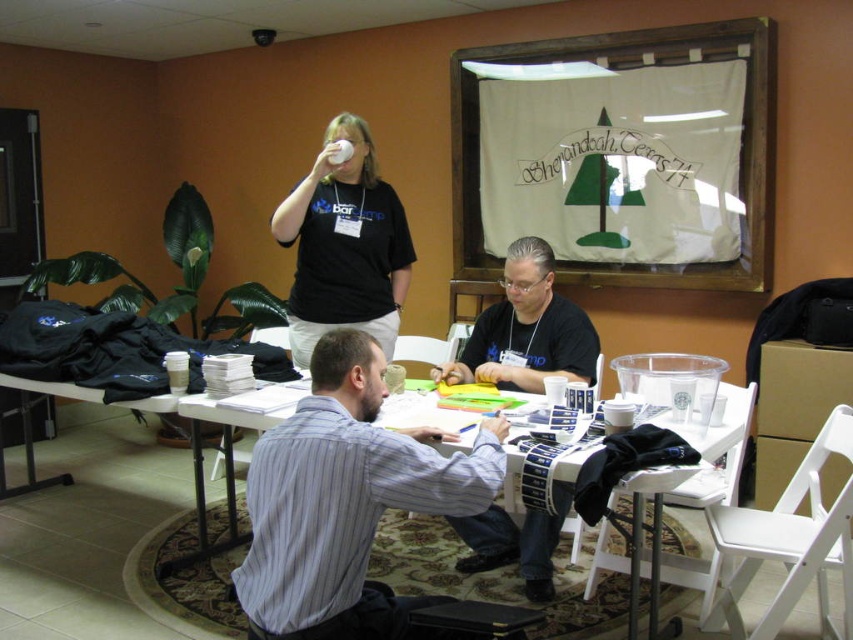
Who is more forward, (292, 483) or (383, 304)?

Point (292, 483) is in front.

Can you confirm if striped cotton shirt at center is taller than matte black shirt at upper center?

Incorrect, striped cotton shirt at center's height is not larger of matte black shirt at upper center's.

Where is `striped cotton shirt at center`? Image resolution: width=853 pixels, height=640 pixels. striped cotton shirt at center is located at coordinates (345, 499).

Identify the location of striped cotton shirt at center. (345, 499).

Who is positioned more to the right, striped cotton shirt at center or white plastic table at center?

white plastic table at center

Which of these two, striped cotton shirt at center or white plastic table at center, stands taller?

With more height is striped cotton shirt at center.

Is point (358, 385) less distant than point (410, 515)?

Yes, point (358, 385) is closer to viewer.

I want to click on striped cotton shirt at center, so click(345, 499).

Is point (529, 244) positioned after point (421, 408)?

Yes, point (529, 244) is behind point (421, 408).

The image size is (853, 640). What do you see at coordinates (527, 330) in the screenshot?
I see `black matte shirt at center` at bounding box center [527, 330].

Image resolution: width=853 pixels, height=640 pixels. I want to click on black matte shirt at center, so click(527, 330).